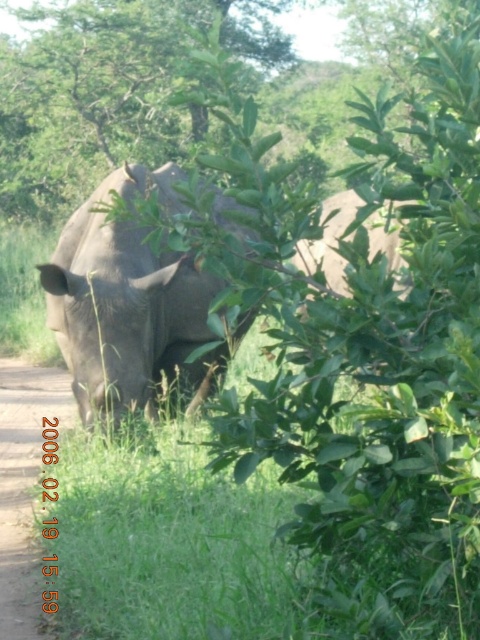
Which is more to the right, gray matte rhinoceros at center or dirt path at lower left?

From the viewer's perspective, gray matte rhinoceros at center appears more on the right side.

Between gray matte rhinoceros at center and dirt path at lower left, which one appears on the left side from the viewer's perspective?

Positioned to the left is dirt path at lower left.

Between point (120, 353) and point (46, 618), which one is positioned in front?

Positioned in front is point (46, 618).

At what (x,y) coordinates should I click in order to perform the action: click on gray matte rhinoceros at center. Please return your answer as a coordinate pair (x, y). Looking at the image, I should click on (127, 308).